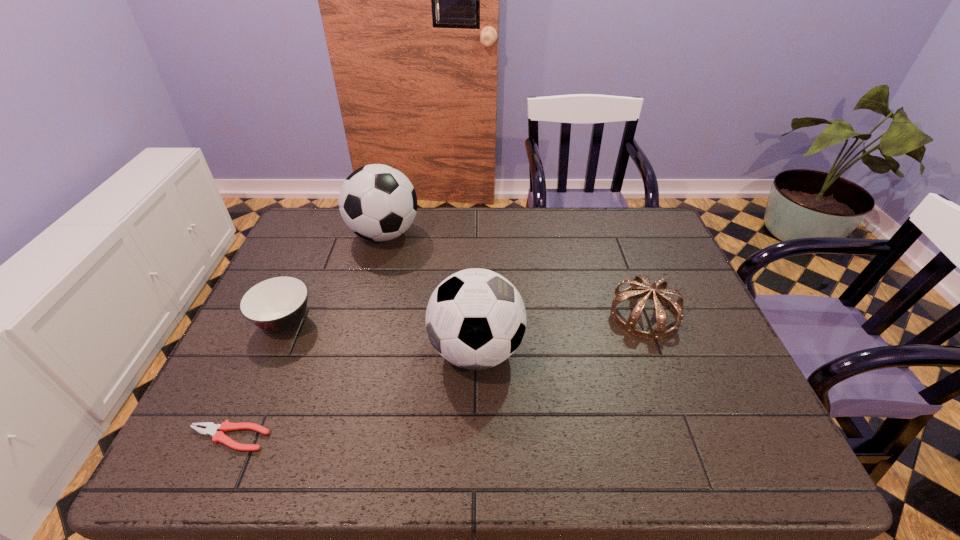
At what (x,y) coordinates should I click in order to perform the action: click on free space between the farther soccer ball and the tiara. Please return your answer as a coordinate pair (x, y). This screenshot has height=540, width=960. Looking at the image, I should click on (514, 274).

You are a GUI agent. You are given a task and a screenshot of the screen. Output one action in this format:
    pyautogui.click(x=<x>, y=<y>)
    Task: Click on the unoccupied position between the farther soccer ball and the tiara
    Image resolution: width=960 pixels, height=540 pixels.
    Given the screenshot: What is the action you would take?
    pyautogui.click(x=514, y=274)

Locate an element on the screen. This screenshot has width=960, height=540. unoccupied area between the shortest object and the second object from right to left is located at coordinates (x=352, y=394).

Where is `free spot between the left soccer ball and the second shortest object`? free spot between the left soccer ball and the second shortest object is located at coordinates (334, 278).

Identify the location of free space between the shortest object and the fourth object from left to right. This screenshot has height=540, width=960. (352, 394).

At what (x,y) coordinates should I click in order to perform the action: click on vacant space in between the farthest object and the nearest object. Please return your answer as a coordinate pair (x, y). This screenshot has height=540, width=960. Looking at the image, I should click on (306, 336).

Identify the location of the closest object to the shortest object. This screenshot has height=540, width=960. (277, 304).

Identify which object is the second nearest to the soup bowl. Please provide its 2D coordinates. Your answer should be formatted as a tuple, i.e. [(x, y)], where the tuple contains the x and y coordinates of a point satisfying the conditions above.

[(211, 429)]